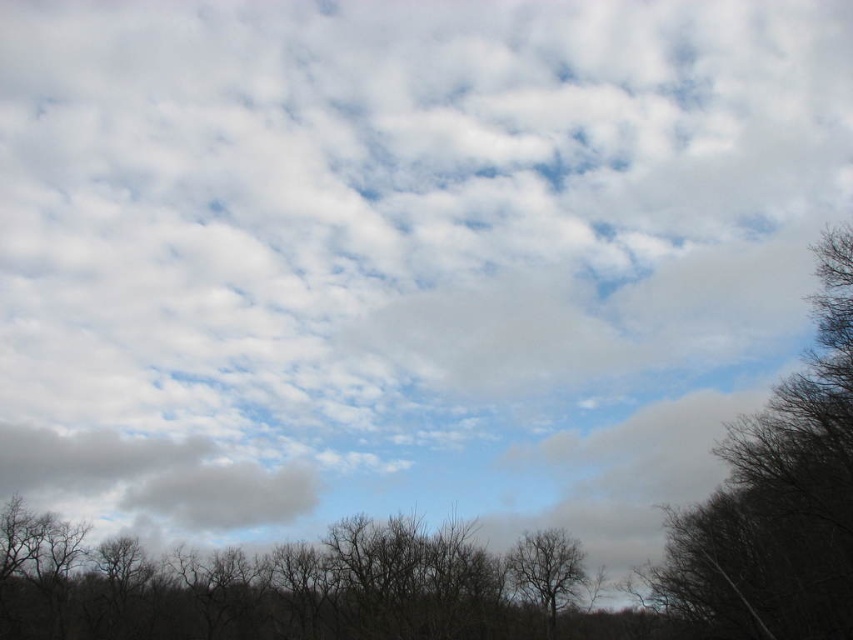
Question: Does gray fluffy cloud at lower left appear over bare branches at center?

Choices:
 (A) yes
 (B) no

Answer: (A)

Question: From the image, what is the correct spatial relationship of brown/dry wood trees at center in relation to gray fluffy cloud at lower left?

Choices:
 (A) below
 (B) above

Answer: (A)

Question: Does gray fluffy cloud at lower left have a lesser width compared to bare branches at center?

Choices:
 (A) yes
 (B) no

Answer: (B)

Question: Among these points, which one is nearest to the camera?

Choices:
 (A) (548, 572)
 (B) (253, 509)
 (C) (323, 628)

Answer: (A)

Question: Which point appears farthest from the camera in this image?

Choices:
 (A) (796, 557)
 (B) (560, 552)
 (C) (258, 621)

Answer: (C)

Question: Among these objects, which one is nearest to the camera?

Choices:
 (A) gray fluffy cloud at lower left
 (B) bare branches at center
 (C) bare branches at right

Answer: (C)